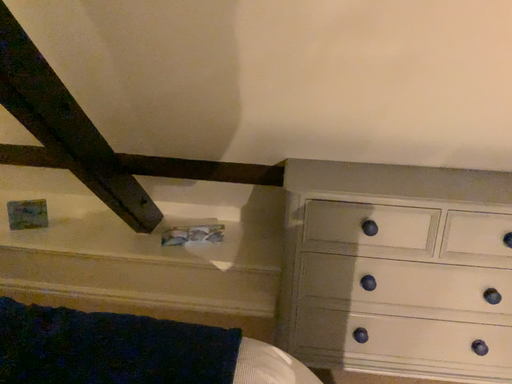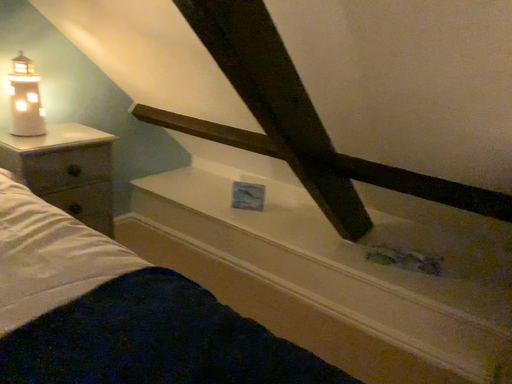
Question: Which way did the camera rotate in the video?

Choices:
 (A) rotated right
 (B) rotated left

Answer: (B)